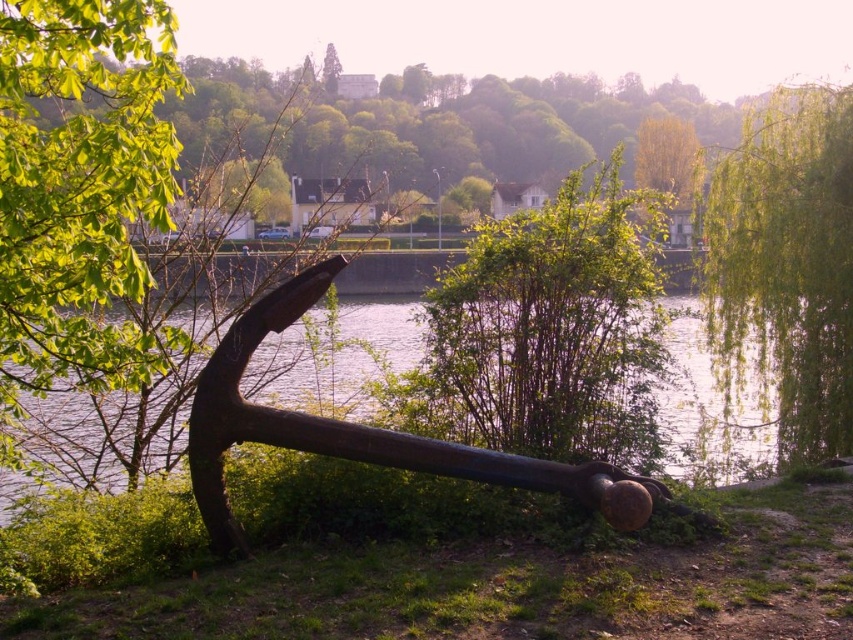
Can you confirm if green leafy tree at center is positioned above green leafy bush at center?

No.

Between point (51, 314) and point (576, 234), which one is positioned in front?

Point (51, 314) is more forward.

Does point (141, 372) lie behind point (502, 300)?

No, it is in front of (502, 300).

You are a GUI agent. You are given a task and a screenshot of the screen. Output one action in this format:
    pyautogui.click(x=<x>, y=<y>)
    Task: Click on the green leafy tree at center
    The height and width of the screenshot is (640, 853).
    Given the screenshot: What is the action you would take?
    pyautogui.click(x=80, y=193)

This screenshot has height=640, width=853. I want to click on green leafy tree at right, so click(786, 266).

Does green leafy tree at right have a lesser height compared to yellow-green leafy tree at upper center?

Incorrect, green leafy tree at right's height does not fall short of yellow-green leafy tree at upper center's.

You are a GUI agent. You are given a task and a screenshot of the screen. Output one action in this format:
    pyautogui.click(x=<x>, y=<y>)
    Task: Click on the green leafy tree at right
    This screenshot has height=640, width=853.
    Given the screenshot: What is the action you would take?
    pyautogui.click(x=786, y=266)

I want to click on green leafy tree at right, so (786, 266).

Is point (653, 365) positioned in front of point (747, 342)?

Yes.

Is green leafy bush at center positioned before green leafy tree at right?

That is True.

Find the location of a particular element. The width and height of the screenshot is (853, 640). green leafy bush at center is located at coordinates (548, 333).

At what (x,y) coordinates should I click in order to perform the action: click on green leafy bush at center. Please return your answer as a coordinate pair (x, y). This screenshot has height=640, width=853. Looking at the image, I should click on (548, 333).